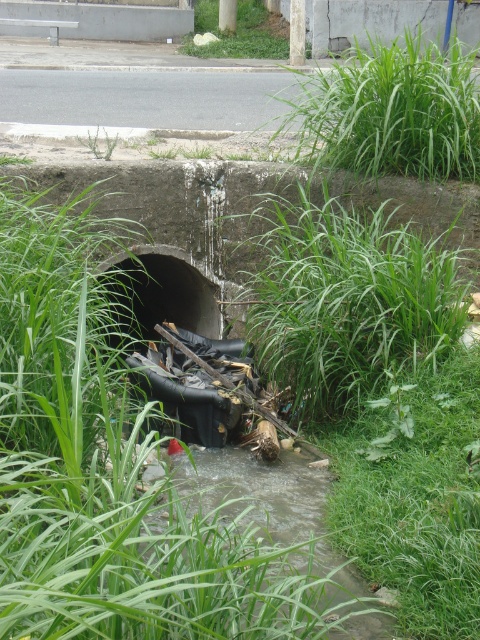
Can you confirm if green leafy grass at upper right is positioned above green leafy weed at center?

Correct, green leafy grass at upper right is located above green leafy weed at center.

Which is behind, point (321, 160) or point (403, 433)?

Point (321, 160)

Between point (394, 150) and point (358, 451), which one is positioned behind?

The point (394, 150) is behind.

Image resolution: width=480 pixels, height=640 pixels. I want to click on green leafy grass at upper right, so click(x=393, y=112).

Is green leafy grass at center positioned at the back of black rubber hole at center?

No, green leafy grass at center is closer to the viewer.

Which is above, green leafy grass at center or black rubber hole at center?

black rubber hole at center is above.

The image size is (480, 640). Identify the location of green leafy grass at center. (345, 298).

Does green leafy grass at center appear on the left side of clear water stream at center?

In fact, green leafy grass at center is to the right of clear water stream at center.

Which is more to the right, green leafy grass at center or clear water stream at center?

green leafy grass at center is more to the right.

I want to click on green leafy grass at center, so click(x=345, y=298).

Find the location of a particular element. green leafy grass at center is located at coordinates (345, 298).